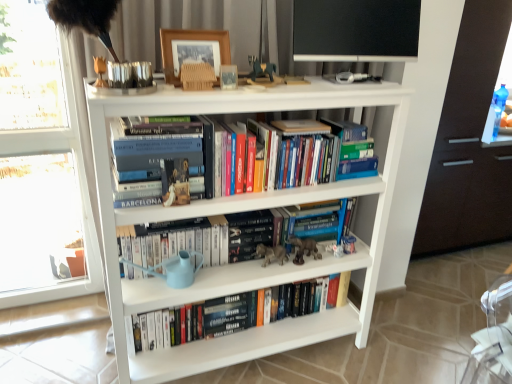
Question: Is matte brown figurine at center facing towards dark brown wood drawer at right?

Choices:
 (A) no
 (B) yes

Answer: (A)

Question: Is matte brown figurine at center outside of dark brown wood drawer at right?

Choices:
 (A) yes
 (B) no

Answer: (A)

Question: From a real-world perspective, does matte brown figurine at center stand above dark brown wood drawer at right?

Choices:
 (A) yes
 (B) no

Answer: (A)

Question: Is the position of matte brown figurine at center less distant than that of dark brown wood drawer at right?

Choices:
 (A) yes
 (B) no

Answer: (A)

Question: Is matte brown figurine at center next to dark brown wood drawer at right?

Choices:
 (A) no
 (B) yes

Answer: (A)

Question: Considering their positions, is dark brown wood drawer at right located in front of or behind wooden picture frame at upper center?

Choices:
 (A) front
 (B) behind

Answer: (B)

Question: In terms of width, does dark brown wood drawer at right look wider or thinner when compared to wooden picture frame at upper center?

Choices:
 (A) thin
 (B) wide

Answer: (B)

Question: From a real-world perspective, is dark brown wood drawer at right positioned above or below wooden picture frame at upper center?

Choices:
 (A) below
 (B) above

Answer: (A)

Question: Considering the positions of dark brown wood drawer at right and wooden picture frame at upper center in the image, is dark brown wood drawer at right taller or shorter than wooden picture frame at upper center?

Choices:
 (A) tall
 (B) short

Answer: (A)

Question: In the image, is wooden picture frame at upper center positioned in front of or behind transparent glass screen door at right?

Choices:
 (A) behind
 (B) front

Answer: (B)

Question: From a real-world perspective, relative to transparent glass screen door at right, is wooden picture frame at upper center vertically above or below?

Choices:
 (A) above
 (B) below

Answer: (A)

Question: Considering the positions of wooden picture frame at upper center and transparent glass screen door at right in the image, is wooden picture frame at upper center wider or thinner than transparent glass screen door at right?

Choices:
 (A) wide
 (B) thin

Answer: (B)

Question: In terms of size, does wooden picture frame at upper center appear bigger or smaller than transparent glass screen door at right?

Choices:
 (A) small
 (B) big

Answer: (A)

Question: In the image, is wooden picture frame at upper center on the left side or the right side of black matte computer monitor at upper center?

Choices:
 (A) right
 (B) left

Answer: (B)

Question: In terms of size, does wooden picture frame at upper center appear bigger or smaller than black matte computer monitor at upper center?

Choices:
 (A) small
 (B) big

Answer: (A)